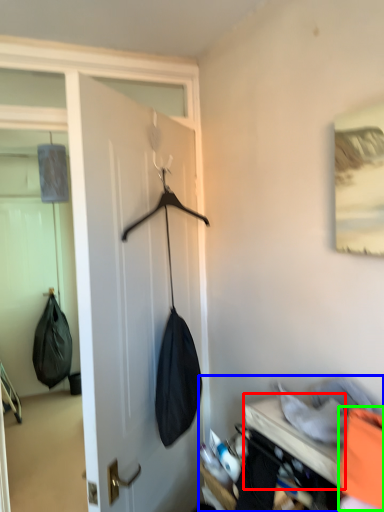
Question: Considering the real-world distances, which object is closest to furniture (highlighted by a red box)? closet (highlighted by a blue box) or clothing (highlighted by a green box).

Choices:
 (A) closet
 (B) clothing

Answer: (A)